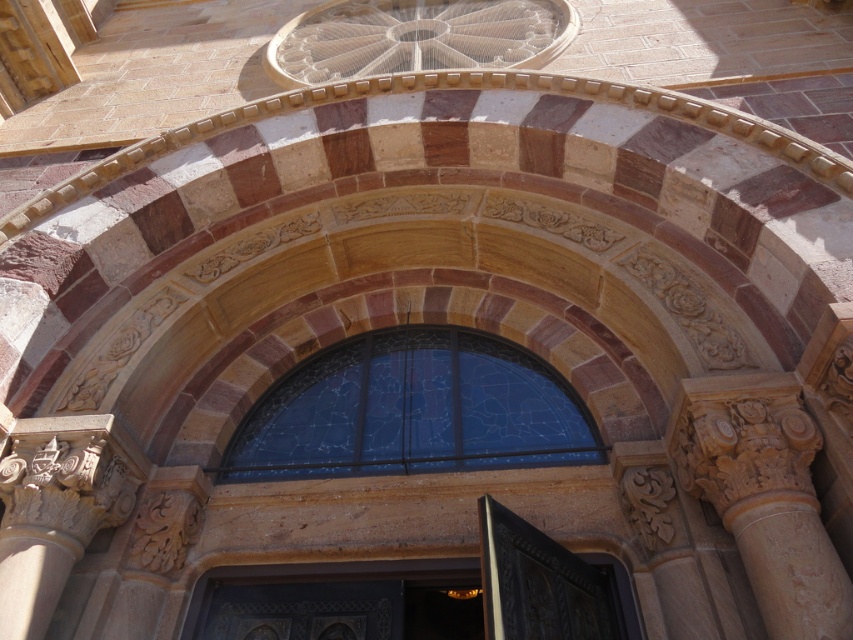
Describe the element at coordinates (410, 410) in the screenshot. I see `stained glass window at center` at that location.

Is stained glass window at center further to camera compared to polished brass door at center?

Yes, it is behind polished brass door at center.

Measure the distance between point (300, 442) and camera.

A distance of 27.11 meters exists between point (300, 442) and camera.

You are a GUI agent. You are given a task and a screenshot of the screen. Output one action in this format:
    pyautogui.click(x=<x>, y=<y>)
    Task: Click on the stained glass window at center
    The width and height of the screenshot is (853, 640).
    Given the screenshot: What is the action you would take?
    pyautogui.click(x=410, y=410)

Does point (352, 364) lie behind point (729, 502)?

Yes, point (352, 364) is behind point (729, 502).

Does stained glass window at center have a greater height compared to carved stone column at right?

Correct, stained glass window at center is much taller as carved stone column at right.

Identify the location of stained glass window at center. (410, 410).

Does carved stone column at right have a lesser width compared to polished brass door at center?

No.

Does carved stone column at right appear on the right side of polished brass door at center?

Yes, carved stone column at right is to the right of polished brass door at center.

This screenshot has width=853, height=640. Identify the location of carved stone column at right. (764, 497).

Locate an element on the screen. carved stone column at right is located at coordinates (764, 497).